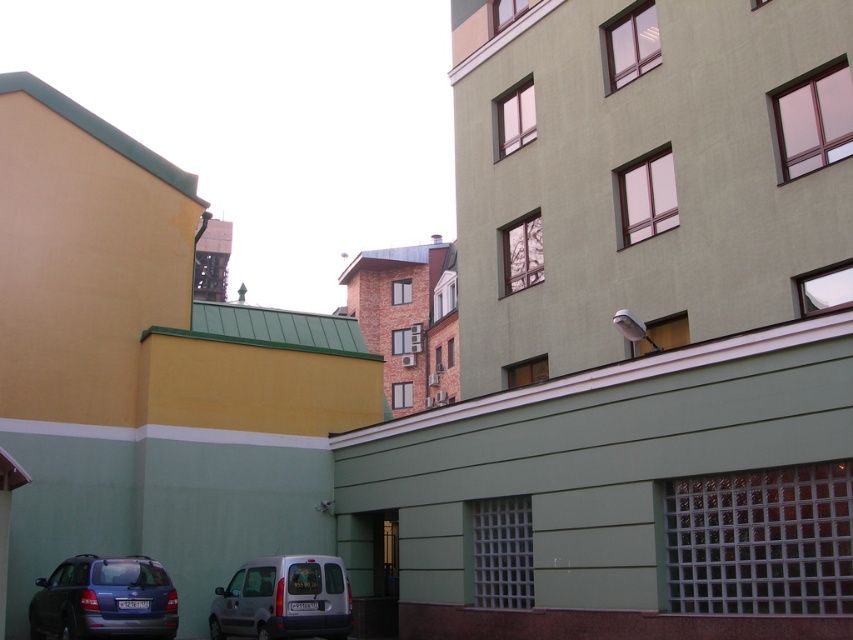
Question: Is matte blue station wagon at lower left positioned before silver metallic van at lower left?

Choices:
 (A) no
 (B) yes

Answer: (B)

Question: Is matte blue station wagon at lower left to the left of silver metallic van at lower left from the viewer's perspective?

Choices:
 (A) no
 (B) yes

Answer: (B)

Question: Which object is farther from the camera taking this photo?

Choices:
 (A) matte blue station wagon at lower left
 (B) silver metallic van at lower left

Answer: (B)

Question: Can you confirm if matte blue station wagon at lower left is bigger than silver metallic van at lower left?

Choices:
 (A) no
 (B) yes

Answer: (A)

Question: Which point is farther from the camera taking this photo?

Choices:
 (A) (44, 586)
 (B) (258, 570)

Answer: (A)

Question: Which object appears closest to the camera in this image?

Choices:
 (A) silver metallic van at lower left
 (B) matte blue station wagon at lower left

Answer: (B)